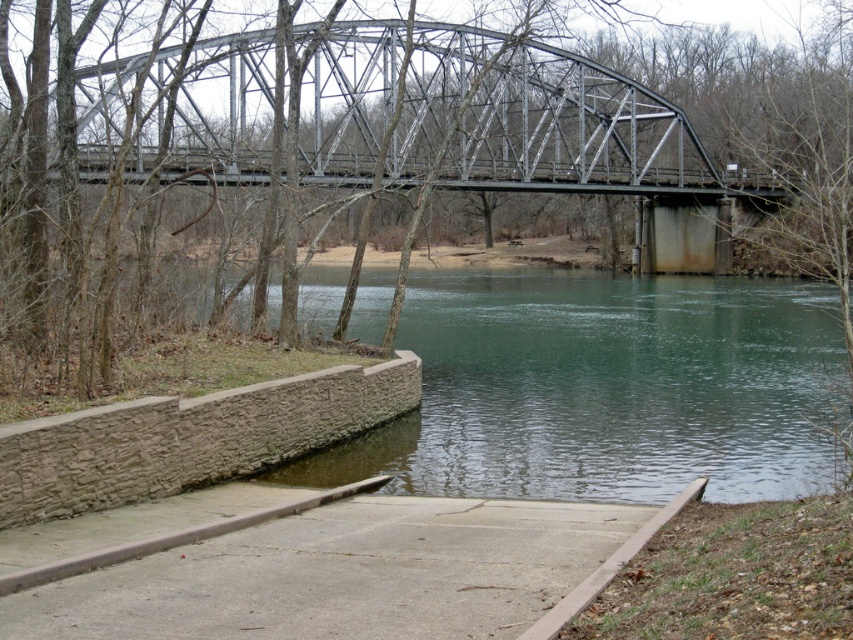
Does metallic gray bridge at upper center have a smaller size compared to concrete at center?

Incorrect, metallic gray bridge at upper center is not smaller in size than concrete at center.

At what (x,y) coordinates should I click in order to perform the action: click on metallic gray bridge at upper center. Please return your answer as a coordinate pair (x, y). Looking at the image, I should click on (386, 116).

Where is `metallic gray bridge at upper center`? The image size is (853, 640). metallic gray bridge at upper center is located at coordinates (386, 116).